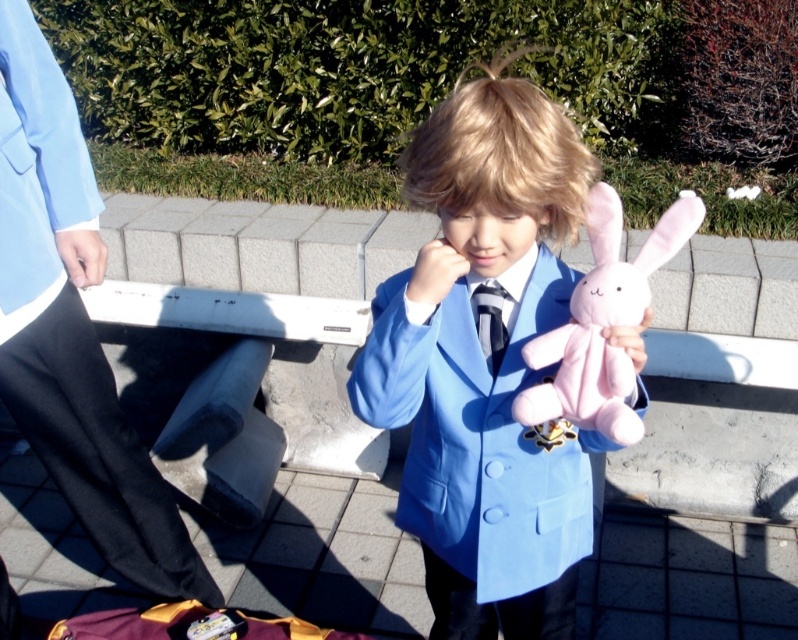
Question: Does pink plush at center lie behind matte black tie at center?

Choices:
 (A) no
 (B) yes

Answer: (A)

Question: Which of the following is the closest to the observer?

Choices:
 (A) pink plush at center
 (B) matte blue suit at center

Answer: (B)

Question: From the image, what is the correct spatial relationship of pink plush at center in relation to matte black tie at center?

Choices:
 (A) above
 (B) below

Answer: (A)

Question: Does matte blue suit at center have a greater width compared to pink plush at center?

Choices:
 (A) no
 (B) yes

Answer: (B)

Question: Which point is farther from the camera taking this photo?

Choices:
 (A) (480, 289)
 (B) (496, 420)

Answer: (B)

Question: Estimate the real-world distances between objects in this image. Which object is closer to the pink plush at center?

Choices:
 (A) matte blue suit at center
 (B) matte black tie at center

Answer: (B)